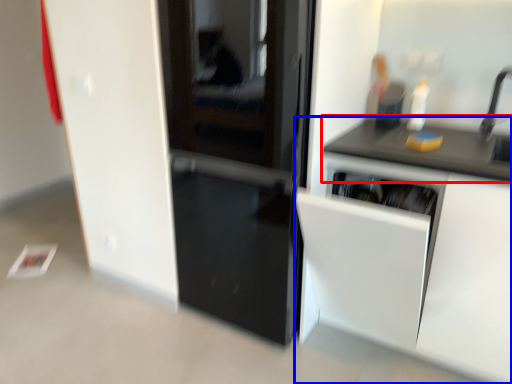
Question: Which of the following is the closest to the observer, countertop (highlighted by a red box) or cabinetry (highlighted by a blue box)?

Choices:
 (A) countertop
 (B) cabinetry

Answer: (B)